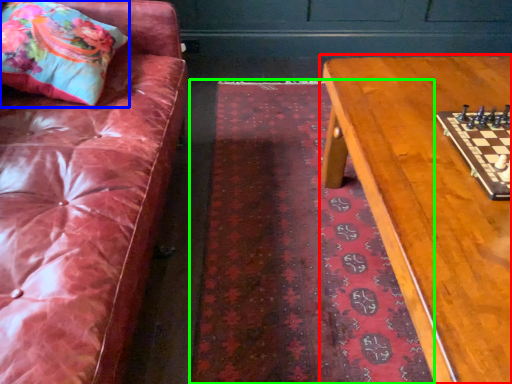
Question: Estimate the real-world distances between objects in this image. Which object is closer to table (highlighted by a red box), throw pillow (highlighted by a blue box) or mat (highlighted by a green box)?

Choices:
 (A) throw pillow
 (B) mat

Answer: (B)